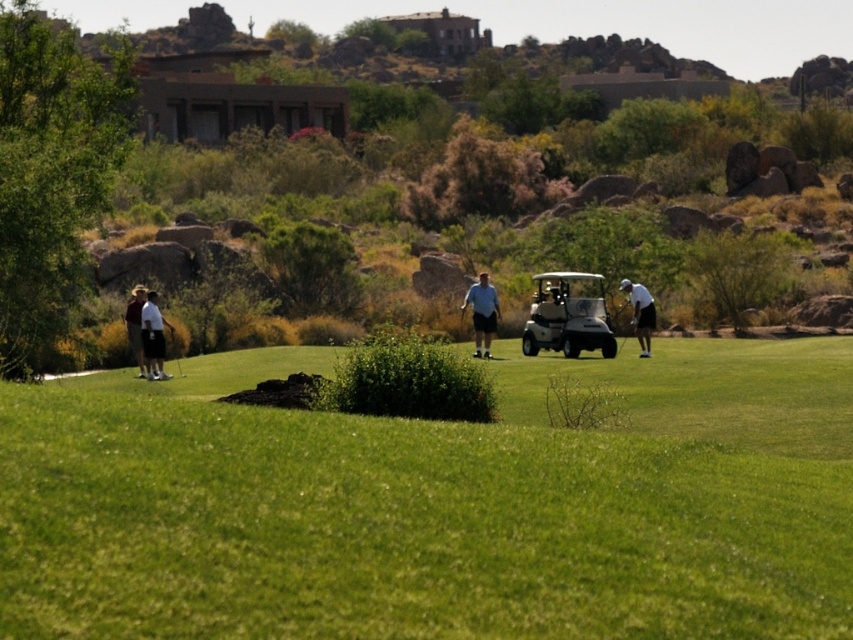
You are a golfer standing on the green lawn and see the white matte golf cart at center and the metallic silver golf club at left. Which object is closer to you?

The white matte golf cart at center is closer to you because it is further to the viewer than the metallic silver golf club at left.

You are standing at the point with coordinates point [149,320] and want to walk towards the point with coordinates point [178,352]. Which direction should you move in relation to the golf course layout?

You should move towards the point [178,352], which is behind the point [149,320] in the golf course layout.